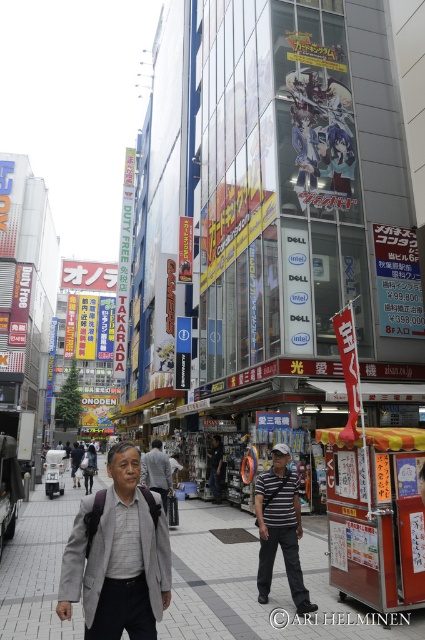
Question: Can you confirm if striped fabric shirt at center is thinner than dark gray shirt at center?

Choices:
 (A) yes
 (B) no

Answer: (A)

Question: Which point is farther to the camera?

Choices:
 (A) (261, 548)
 (B) (218, 458)

Answer: (B)

Question: Does gray concrete sidewalk at center appear over striped fabric shirt at center?

Choices:
 (A) no
 (B) yes

Answer: (A)

Question: Estimate the real-world distances between objects in this image. Which object is closer to the dark gray shirt at center?

Choices:
 (A) gray fabric jacket at center
 (B) striped shirt at center

Answer: (B)

Question: Can you confirm if dark gray shirt at center is positioned below striped shirt at center?

Choices:
 (A) yes
 (B) no

Answer: (B)

Question: Which object appears closest to the camera in this image?

Choices:
 (A) striped shirt at center
 (B) gray concrete sidewalk at center
 (C) dark gray shirt at center
 (D) striped fabric shirt at center

Answer: (B)